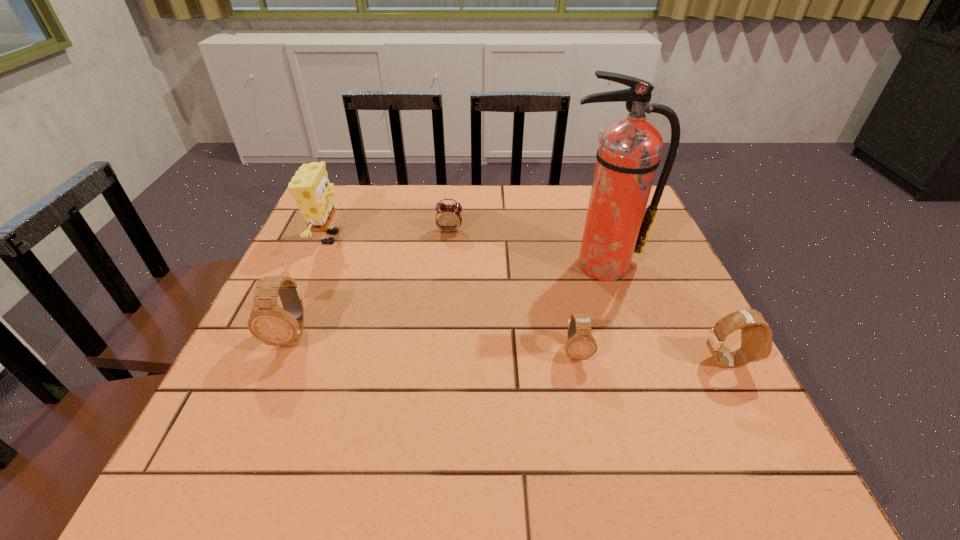
Locate an element on the screen. This screenshot has height=540, width=960. free location at the far edge of the desktop is located at coordinates (443, 232).

The height and width of the screenshot is (540, 960). What are the coordinates of `vacant space at the near edge of the desktop` in the screenshot? It's located at (494, 410).

The width and height of the screenshot is (960, 540). In the image, there is a desktop. What are the coordinates of `free region at the left edge` in the screenshot? It's located at (319, 344).

In the image, there is a desktop. At what (x,y) coordinates should I click in order to perform the action: click on vacant space at the right edge. Please return your answer as a coordinate pair (x, y). This screenshot has width=960, height=540. Looking at the image, I should click on (663, 314).

Find the location of a particular element. Image resolution: width=960 pixels, height=540 pixels. vacant region at the far left corner of the desktop is located at coordinates [x=353, y=187].

The width and height of the screenshot is (960, 540). I want to click on vacant area between the alarm clock and the leftmost watch, so click(371, 284).

You are a GUI agent. You are given a task and a screenshot of the screen. Output one action in this format:
    pyautogui.click(x=<x>, y=<y>)
    Task: Click on the unoccupied position between the sponge and the tallest watch
    The height and width of the screenshot is (540, 960).
    Given the screenshot: What is the action you would take?
    pyautogui.click(x=311, y=287)

You are a GUI agent. You are given a task and a screenshot of the screen. Output one action in this format:
    pyautogui.click(x=<x>, y=<y>)
    Task: Click on the vacant space that is in between the second tallest object and the fire extinguisher
    
    Given the screenshot: What is the action you would take?
    pyautogui.click(x=465, y=252)

Image resolution: width=960 pixels, height=540 pixels. Identify the location of vacant area that lies between the alarm clock and the fire extinguisher. (525, 248).

Locate an element on the screen. free spot between the sponge and the second watch from right to left is located at coordinates point(452,295).